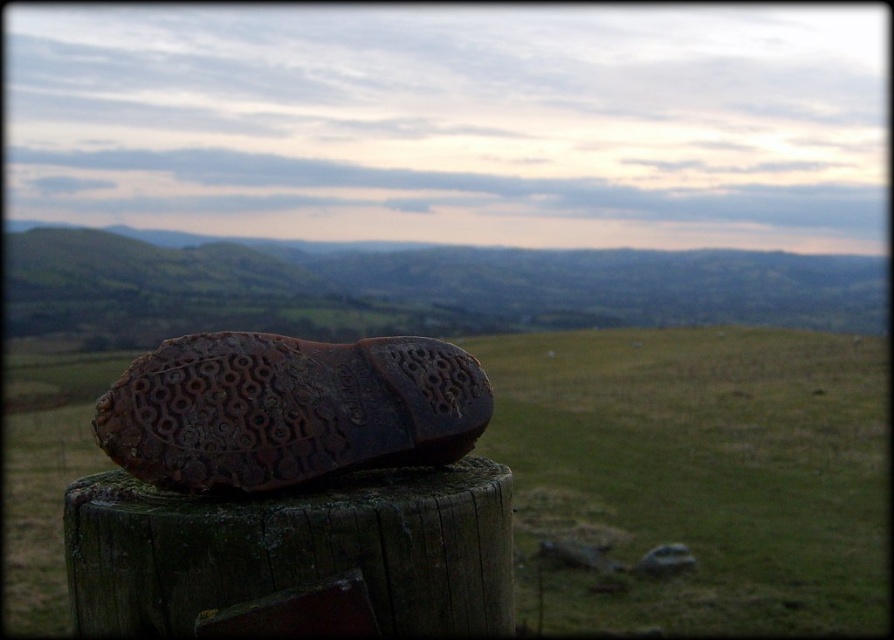
You are a hiker who has just arrived at this serene landscape. You notice two shoes at the center of your view. Which one is bigger between the brown leather shoe at center and the brown rubber shoe at center?

The brown leather shoe at center is larger in size than the brown rubber shoe at center.

You are a hiker who has just noticed two shoes on the ground ahead of you. You need to retrieve them both. The brown leather shoe at center is your favorite pair, and the brown rubber shoe at center is a spare. Given that you can only move forward in a straight line, which shoe will you reach first?

The brown leather shoe at center will be reached first since it is closer to you than the brown rubber shoe at center. The distance between them is 2.38 meters, so the brown leather shoe at center is in front of the brown rubber shoe at center along your path.

You are a hiker who just arrived at the scene. You see two shoes, a brown leather shoe at center and a brown rubber shoe at center. Which one is positioned lower in the image?

The brown leather shoe at center is positioned lower in the image because it is below the brown rubber shoe at center.